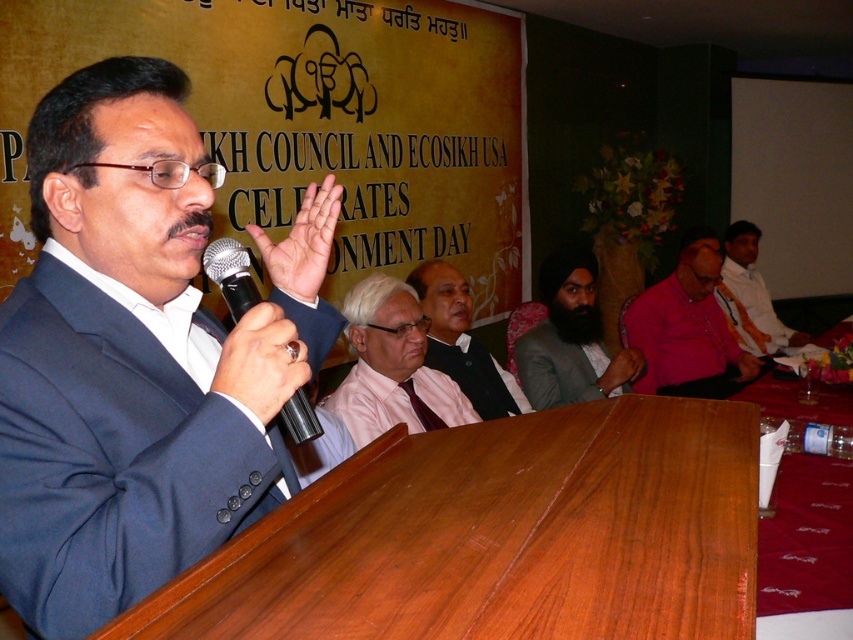
Does pink fabric shirt at center have a greater height compared to black satin business suit at center?

Correct, pink fabric shirt at center is much taller as black satin business suit at center.

Is pink fabric shirt at center wider than black satin business suit at center?

Yes.

The image size is (853, 640). Identify the location of pink fabric shirt at center. (392, 365).

Is black satin business suit at center positioned before black metallic microphone at center?

That is False.

Is black satin business suit at center thinner than black metallic microphone at center?

In fact, black satin business suit at center might be wider than black metallic microphone at center.

Is point (480, 416) in front of point (252, 291)?

That is False.

At what (x,y) coordinates should I click in order to perform the action: click on black satin business suit at center. Please return your answer as a coordinate pair (x, y). This screenshot has width=853, height=640. Looking at the image, I should click on (476, 376).

Is point (273, 356) in front of point (244, 252)?

Yes.

The width and height of the screenshot is (853, 640). I want to click on blue suit at center, so click(138, 355).